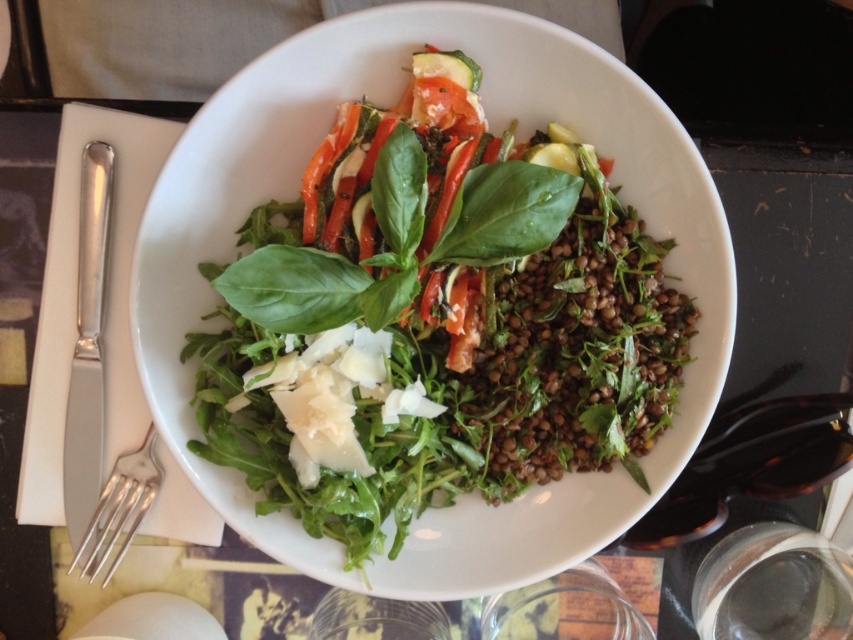
Is green leafy salad at center to the right of satin finish knife at left from the viewer's perspective?

Yes, green leafy salad at center is to the right of satin finish knife at left.

Can you confirm if green leafy salad at center is positioned to the left of satin finish knife at left?

Incorrect, green leafy salad at center is not on the left side of satin finish knife at left.

This screenshot has height=640, width=853. I want to click on green leafy salad at center, so click(x=437, y=330).

Locate an element on the screen. Image resolution: width=853 pixels, height=640 pixels. green leafy salad at center is located at coordinates (437, 330).

Between green leafy salad at center and satin silver fork at lower left, which one appears on the left side from the viewer's perspective?

Positioned to the left is satin silver fork at lower left.

Identify the location of green leafy salad at center. (437, 330).

Find the location of a particular element. green leafy salad at center is located at coordinates (437, 330).

Does satin finish knife at left lie in front of satin silver fork at lower left?

No, it is not.

Is point (97, 461) farther from viewer compared to point (80, 576)?

Yes, point (97, 461) is farther from viewer.

Find the location of a particular element. satin finish knife at left is located at coordinates (88, 353).